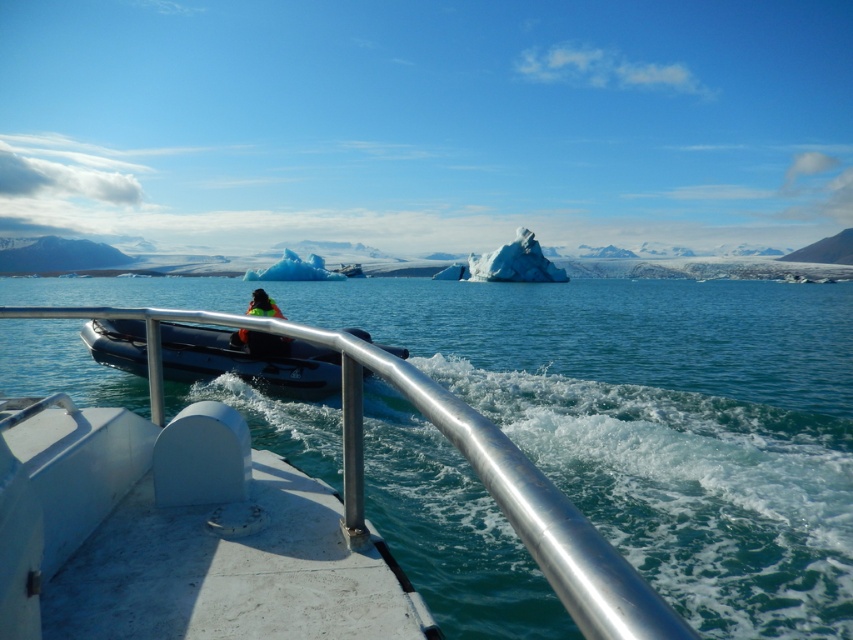
You are standing on the deck of the boat and want to pour water from the clear blue water at center into a container placed on the silver metallic rail at center. Which object is closer to your hand when you reach out to grab it?

The silver metallic rail at center is closer to you than the clear blue water at center, so you would reach the silver metallic rail at center first.

You are a passenger on the boat and want to grab the neon green life vest at center to put it on. Which direction should you move relative to the silver metallic rail at center?

The silver metallic rail at center is positioned on the right side of the neon green life vest at center, so you should move to the left side of the silver metallic rail at center to reach the neon green life vest at center.

You are standing on the deck of the white boat and see two points marked on the water ahead. The first point is labeled as point (x=228, y=356) and the second is point (x=238, y=339). Based on their positions, which point is closer to the front of the boat?

Point (x=228, y=356) is in front of point (x=238, y=339), so it is closer to the front of the boat.